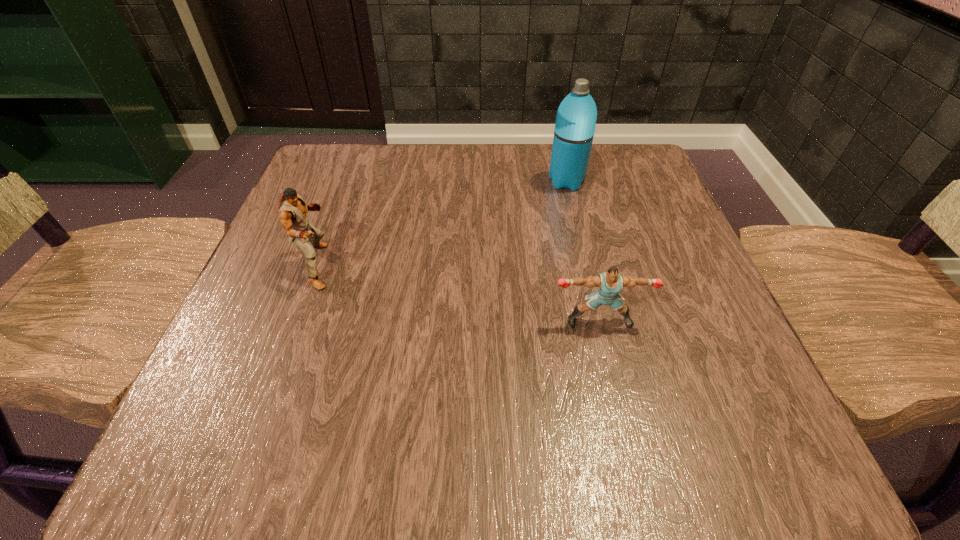
Locate an element on the screen. This screenshot has width=960, height=540. the farthest object is located at coordinates (574, 130).

What are the coordinates of `thermos bottle` in the screenshot? It's located at (574, 130).

Locate an element on the screen. The image size is (960, 540). the second tallest object is located at coordinates (292, 209).

Locate an element on the screen. The height and width of the screenshot is (540, 960). the second nearest object is located at coordinates (292, 209).

Identify the location of the shortest object. (609, 284).

You are a GUI agent. You are given a task and a screenshot of the screen. Output one action in this format:
    pyautogui.click(x=<x>, y=<y>)
    Task: Click on the right puncher
    This screenshot has height=540, width=960.
    Given the screenshot: What is the action you would take?
    pyautogui.click(x=609, y=284)

The width and height of the screenshot is (960, 540). In order to click on vacant region located on the left of the farthest object in this screenshot , I will do `click(489, 181)`.

Identify the location of free space located 0.330m on the front-facing side of the second nearest object. The image size is (960, 540). (524, 266).

Where is `vacant space located on the front-facing side of the shorter puncher`? Image resolution: width=960 pixels, height=540 pixels. vacant space located on the front-facing side of the shorter puncher is located at coordinates (628, 444).

In order to click on object that is at the far edge in this screenshot , I will do `click(574, 130)`.